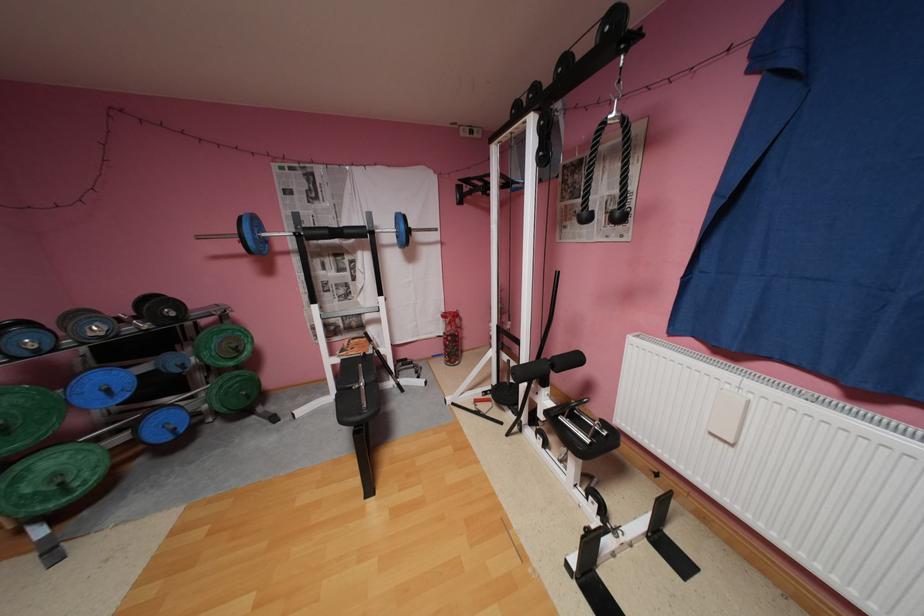
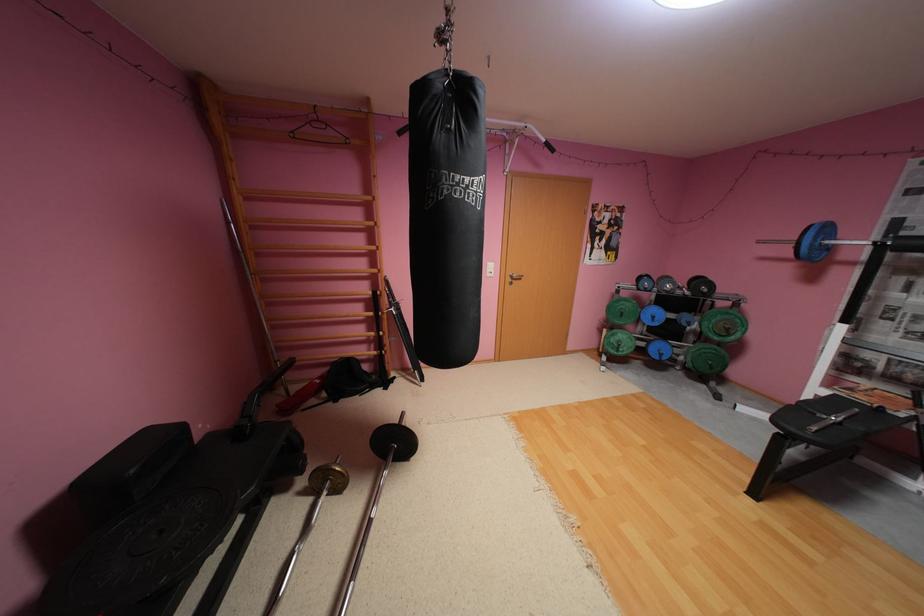
Find the pixel in the second image that matches point (264, 222) in the first image.

(835, 229)